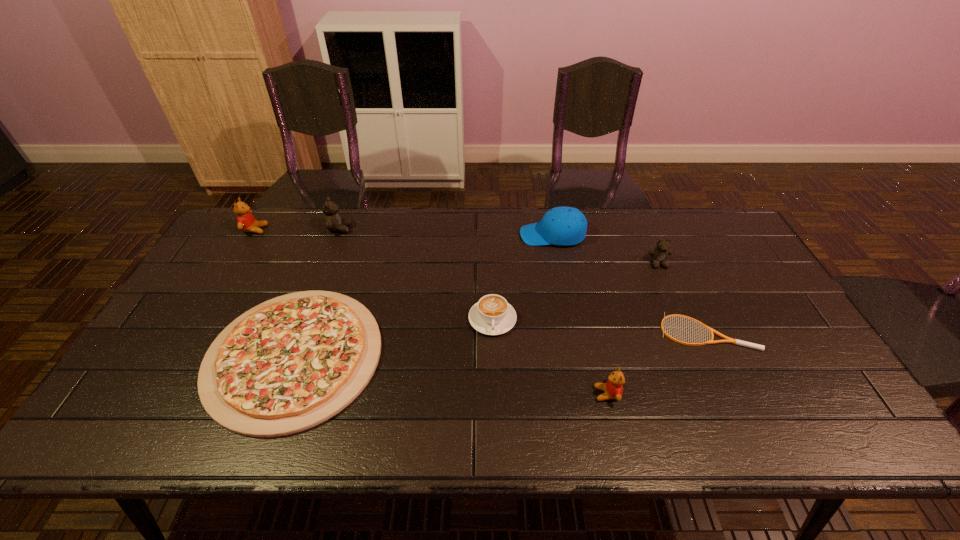
At what (x,y) coordinates should I click in order to perform the action: click on free spot located 0.120m on the front-facing side of the smaller red teddy bear. Please return your answer as a coordinate pair (x, y). The height and width of the screenshot is (540, 960). Looking at the image, I should click on (544, 394).

Where is `blank area located 0.250m on the front-facing side of the smaller red teddy bear`? blank area located 0.250m on the front-facing side of the smaller red teddy bear is located at coordinates (491, 394).

This screenshot has height=540, width=960. Identify the location of vacant space located on the front-facing side of the smaller red teddy bear. (507, 394).

I want to click on vacant space located 0.210m on the side of the fifth object from right to left with the handle, so click(495, 409).

Identify the location of free region located on the left of the pizza. [189, 356].

At what (x,y) coordinates should I click in order to perform the action: click on vacant region located 0.330m on the left of the beige tennis racket. Please return your answer as a coordinate pair (x, y). Image resolution: width=960 pixels, height=540 pixels. Looking at the image, I should click on (538, 332).

Where is `cap at the far edge`? cap at the far edge is located at coordinates (563, 226).

The height and width of the screenshot is (540, 960). Find the location of `object that is at the near edge`. object that is at the near edge is located at coordinates (293, 362).

The height and width of the screenshot is (540, 960). I want to click on teddy bear situated at the left edge, so click(246, 222).

The image size is (960, 540). What are the coordinates of `pizza that is at the left edge` in the screenshot? It's located at (293, 362).